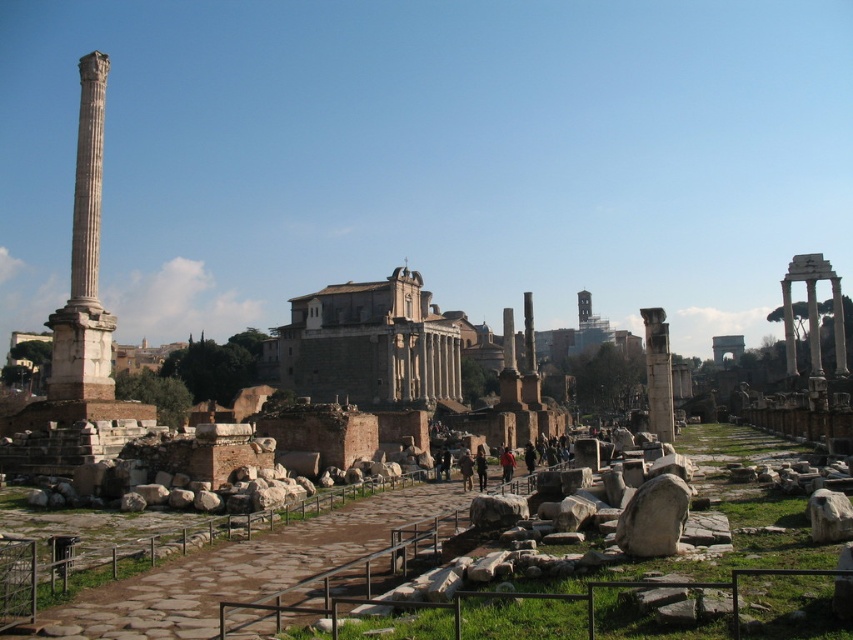
You are a tour guide leading a group through the Roman Forum ruins. You notice two structures in the center of the image. Which one is taller between the smooth gray stone temple at center and the smooth stone column at center?

The smooth gray stone temple at center is taller than the smooth stone column at center.

You are standing at the entrance of the Roman Forum and see the point marked at coordinates [369,344]. What significant structure is located at that point?

The smooth gray stone temple at center is located at point [369,344].